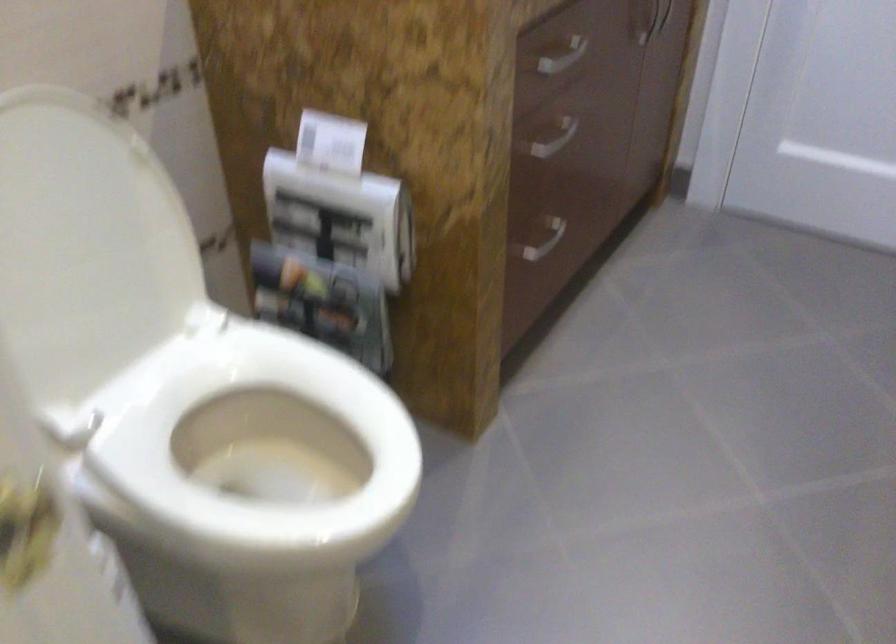
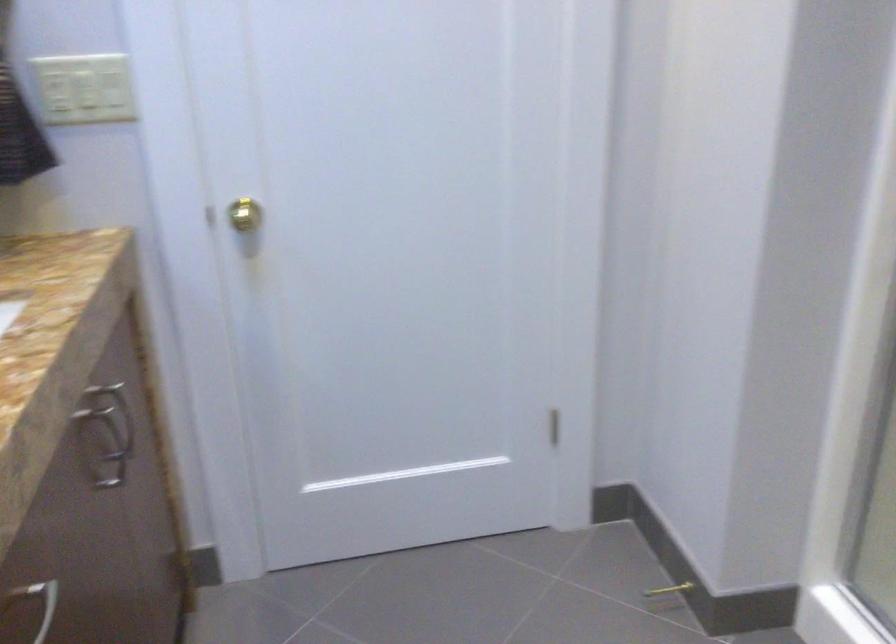
Question: The camera is either moving clockwise (left) or counter-clockwise (right) around the object. The first image is from the beginning of the video and the second image is from the end. Is the camera moving left or right when shooting the video?

Choices:
 (A) Left
 (B) Right

Answer: (A)